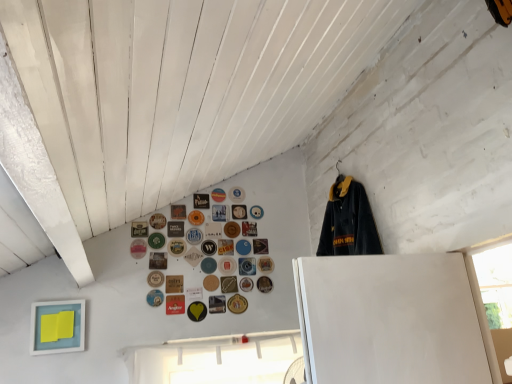
Question: Is point (259, 215) closer or farther from the camera than point (153, 248)?

Choices:
 (A) farther
 (B) closer

Answer: (A)

Question: From a real-world perspective, is matte plastic button at upper center, the 34th button viewed from the left, physically located above or below green matte button at upper center, which is the 4th button in left-to-right order?

Choices:
 (A) below
 (B) above

Answer: (B)

Question: Estimate the real-world distances between objects in this image. Which object is closer to the matte blue button at center, the 32th button positioned from the left?

Choices:
 (A) metallic gold button at upper center, the tenth button viewed from the left
 (B) metallic gold button at upper center, the 27th button in the left-to-right sequence
 (C) green matte button at upper center, acting as the 34th button starting from the right
 (D) matte black button at center, which is counted as the 8th button, starting from the left
 (E) wooden button at upper center, the 35th button from the right

Answer: (B)

Question: Which of these objects is positioned farthest from the matte brown button at center, the 26th button viewed from the left?

Choices:
 (A) white matte button at center, which appears as the twentieth button when viewed from the right
 (B) gold metallic button at center, acting as the 2th button starting from the right
 (C) metallic gold button at upper center, positioned as the fifteenth button in right-to-left order
 (D) gold metallic button at center, which ranks as the 29th button in left-to-right order
 (E) matte yellow paper at lower left

Answer: (E)